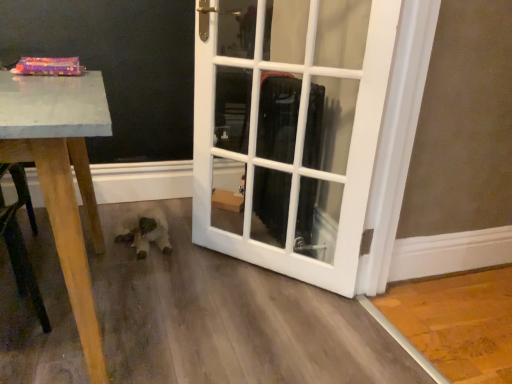
Question: Is white plush toy at lower center outside white glossy door at center?

Choices:
 (A) no
 (B) yes

Answer: (B)

Question: Is white plush toy at lower center taller than white glossy door at center?

Choices:
 (A) yes
 (B) no

Answer: (B)

Question: From the image's perspective, does white plush toy at lower center appear higher than white glossy door at center?

Choices:
 (A) no
 (B) yes

Answer: (A)

Question: Is white plush toy at lower center bigger than white glossy door at center?

Choices:
 (A) no
 (B) yes

Answer: (A)

Question: Can you confirm if white plush toy at lower center is shorter than white glossy door at center?

Choices:
 (A) yes
 (B) no

Answer: (A)

Question: Does white plush toy at lower center contain white glossy door at center?

Choices:
 (A) no
 (B) yes

Answer: (A)

Question: Is white glossy door at center looking in the opposite direction of white plush toy at lower center?

Choices:
 (A) no
 (B) yes

Answer: (A)

Question: Is white glossy door at center located outside white plush toy at lower center?

Choices:
 (A) no
 (B) yes

Answer: (B)

Question: Can you see white glossy door at center touching white plush toy at lower center?

Choices:
 (A) yes
 (B) no

Answer: (B)

Question: Considering the relative sizes of white glossy door at center and white plush toy at lower center in the image provided, is white glossy door at center taller than white plush toy at lower center?

Choices:
 (A) no
 (B) yes

Answer: (B)

Question: Considering the relative sizes of white glossy door at center and white plush toy at lower center in the image provided, is white glossy door at center shorter than white plush toy at lower center?

Choices:
 (A) no
 (B) yes

Answer: (A)

Question: Considering the relative positions of white glossy door at center and white plush toy at lower center in the image provided, is white glossy door at center to the right of white plush toy at lower center from the viewer's perspective?

Choices:
 (A) no
 (B) yes

Answer: (B)

Question: Looking at their shapes, would you say white glossy door at center is wider or thinner than white plush toy at lower center?

Choices:
 (A) wide
 (B) thin

Answer: (B)